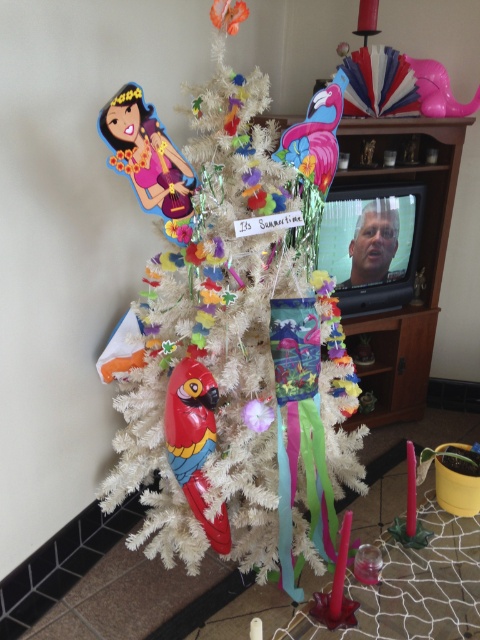
You are a child who wants to see the TV show clearly. You are standing in front of the white artificial christmas tree at center and the shiny plastic parrot at center. Which object is blocking your view of the TV screen?

The white artificial christmas tree at center is taller than the shiny plastic parrot at center, so the white artificial christmas tree at center is blocking your view of the TV screen.

You are standing in front of the Christmas tree scene described. Your friend is holding a gift that is 2 feet long and wants to place it under the white artificial christmas tree at center. Considering the distance between you and the tree, can the gift fit under the tree without needing to move closer?

The white artificial christmas tree at center is 4.40 feet away from the viewer. Since the gift is 2 feet long, it can easily fit under the tree without needing to move closer as the distance allows enough space for placement.